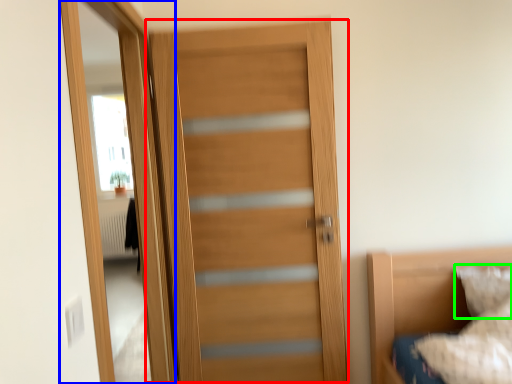
Question: Which object is the farthest from door (highlighted by a red box)? Choose among these: screen door (highlighted by a blue box) or pillow (highlighted by a green box).

Choices:
 (A) screen door
 (B) pillow

Answer: (B)